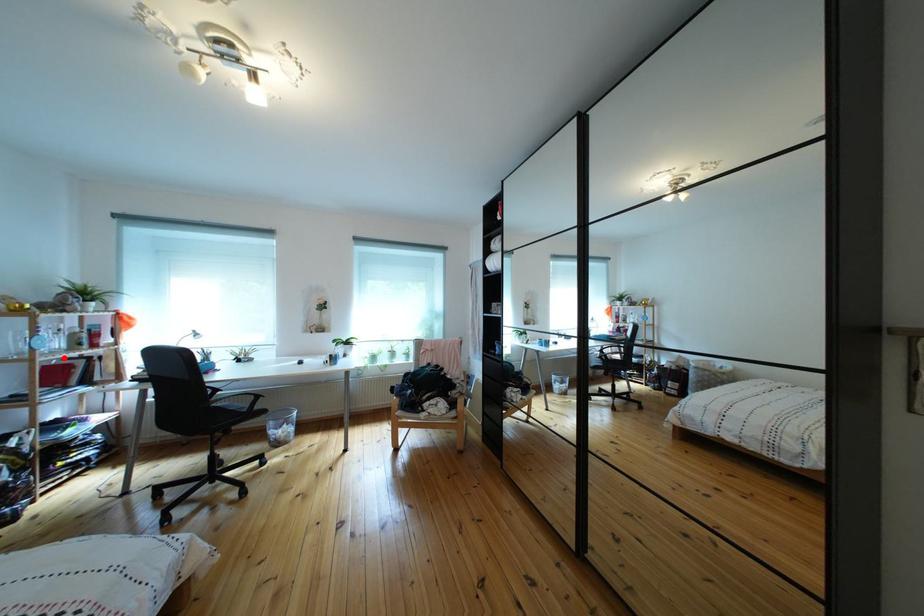
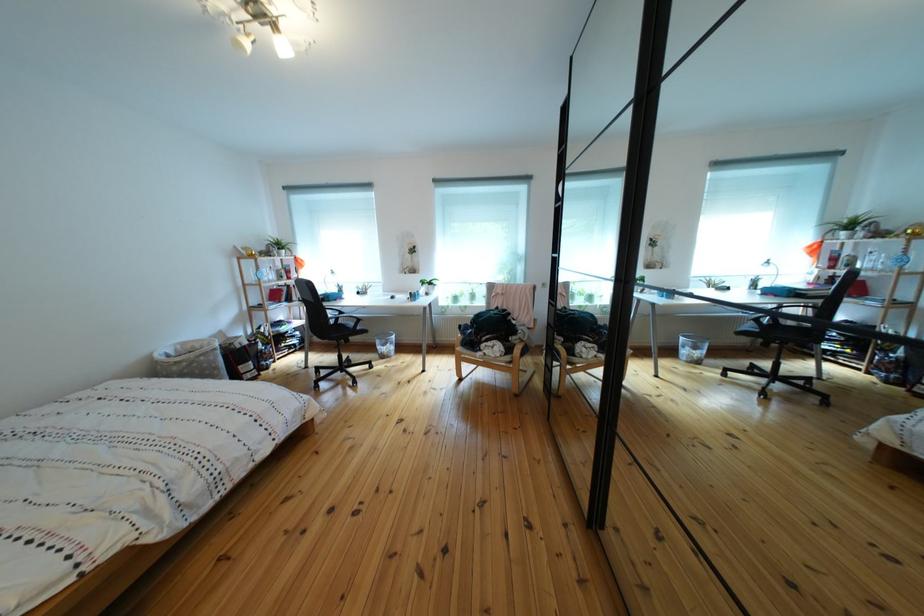
Where in the second image is the point corresponding to the highlighted location from the first image?

(282, 286)